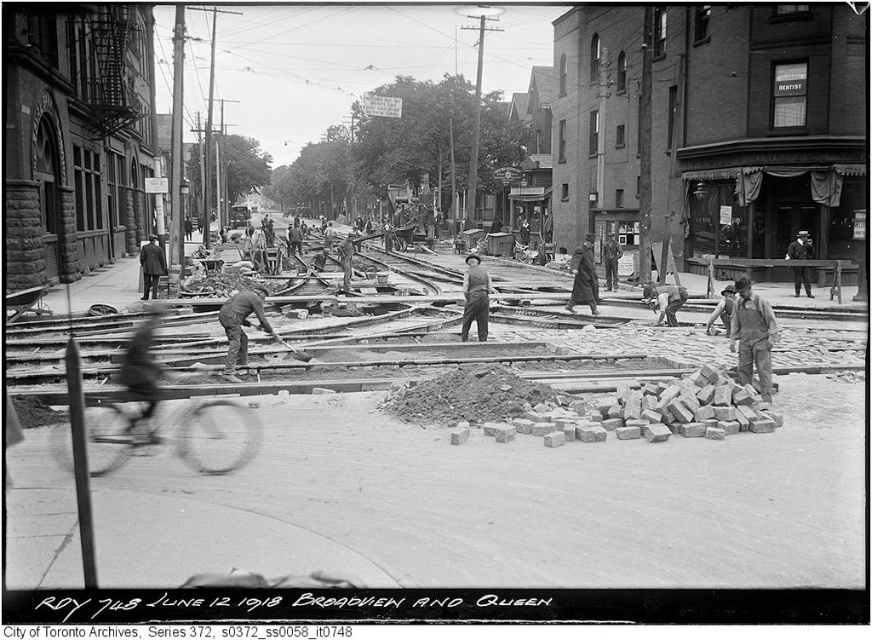
Question: Which of the following is the closest to the observer?

Choices:
 (A) (843, 497)
 (B) (155, 253)

Answer: (A)

Question: Which of the following is the farthest from the observer?

Choices:
 (A) (484, 474)
 (B) (468, 317)
 (C) (794, 282)
 (D) (155, 260)

Answer: (C)

Question: Where is smooth wooden planks at center located in relation to smooth leather hat at center in the image?

Choices:
 (A) left
 (B) right

Answer: (A)

Question: Which of these objects is positioned closest to the smooth wooden planks at center?

Choices:
 (A) smooth leather hat at center
 (B) dark brown suit at left

Answer: (B)

Question: Can you confirm if rustic wooden shovel at center is positioned below dark brown suit at left?

Choices:
 (A) no
 (B) yes

Answer: (B)

Question: Does smooth wooden planks at center appear over rustic wooden shovel at center?

Choices:
 (A) no
 (B) yes

Answer: (A)